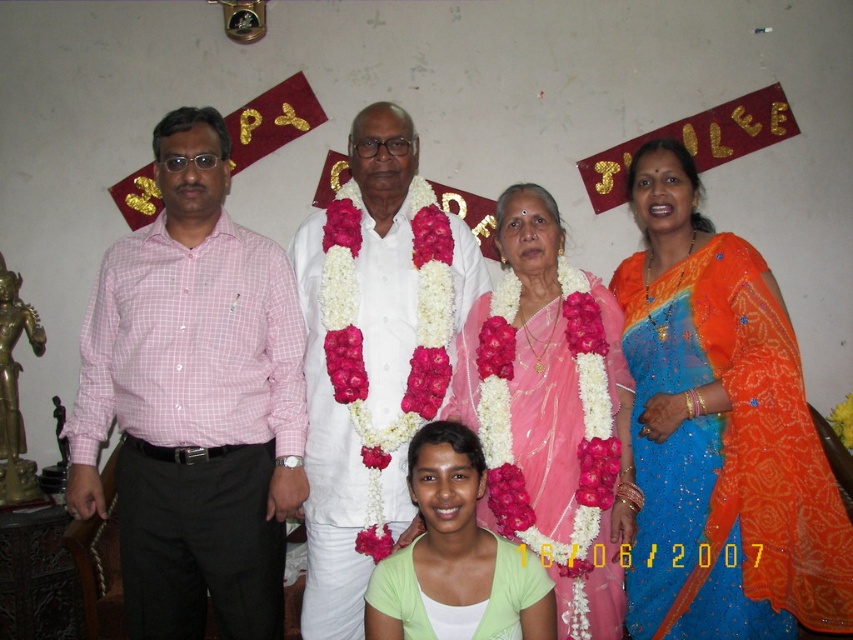
In the image of the family gathering, where is the pink silk saree at center located in terms of its 2D coordinates?

The pink silk saree at center is located at the 2D coordinates point (552,412).

You are a photographer at a family event. You need to adjust the lighting so that the orange sequined saree at right is visible without being overwhelmed by the light green fabric at center. Which object should you focus the light on?

The orange sequined saree at right is in front of the light green fabric at center, so focusing the light on the orange sequined saree at right will ensure it remains visible and not overshadowed by the background fabric.

You are a photographer trying to adjust the lighting for a family photo. You notice the orange sequined saree at right and the white clothed man at center. Which object is positioned lower in the image?

The orange sequined saree at right is below the white clothed man at center, so it is positioned lower in the image.